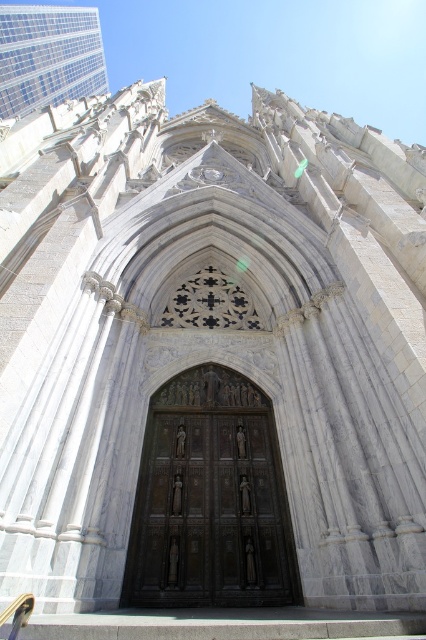
Question: Which of the following is the farthest from the observer?

Choices:
 (A) matte gray stone church at upper left
 (B) dark brown wood at center

Answer: (A)

Question: Does dark brown wood at center appear on the left side of matte gray stone church at upper left?

Choices:
 (A) yes
 (B) no

Answer: (B)

Question: Can you confirm if dark brown wood at center is positioned to the right of matte gray stone church at upper left?

Choices:
 (A) yes
 (B) no

Answer: (A)

Question: Which object is farther from the camera taking this photo?

Choices:
 (A) dark brown wood at center
 (B) matte gray stone church at upper left

Answer: (B)

Question: Can you confirm if dark brown wood at center is smaller than matte gray stone church at upper left?

Choices:
 (A) no
 (B) yes

Answer: (B)